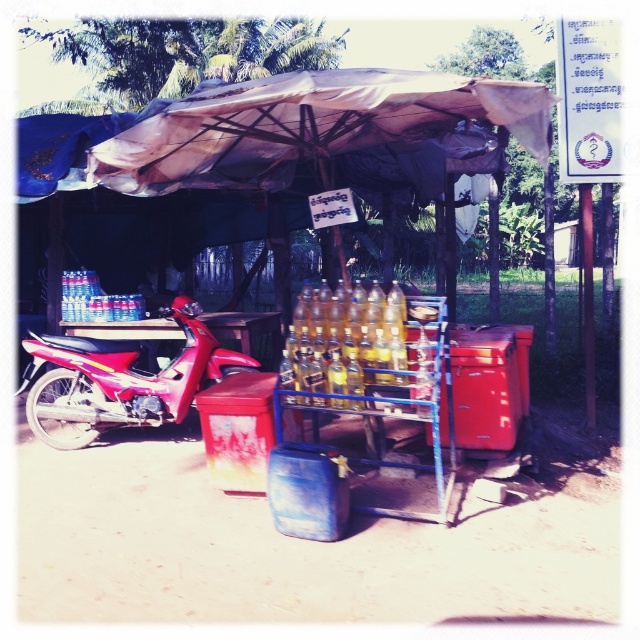
Can you confirm if metallic blue cart at center is taller than metallic red motorcycle at left?

Yes.

Does metallic blue cart at center appear over metallic red motorcycle at left?

No.

Is point (451, 440) closer to viewer compared to point (163, 401)?

Yes, it is.

The height and width of the screenshot is (640, 640). I want to click on metallic blue cart at center, so click(x=368, y=396).

Where is `metallic red motorcycle at left`? This screenshot has width=640, height=640. metallic red motorcycle at left is located at coordinates (120, 380).

Is metallic red motorcycle at left further to camera compared to yellow glass bottles at center?

That is True.

Which is behind, point (144, 417) or point (333, 324)?

The point (144, 417) is more distant.

Locate an element on the screen. metallic red motorcycle at left is located at coordinates click(120, 380).

Who is lower down, metallic blue cart at center or yellow glass bottles at center?

Positioned lower is metallic blue cart at center.

Does metallic blue cart at center have a greater height compared to yellow glass bottles at center?

Yes.

Does point (371, 451) come behind point (312, 340)?

Yes, point (371, 451) is farther from viewer.

At what (x,y) coordinates should I click in order to perform the action: click on metallic blue cart at center. Please return your answer as a coordinate pair (x, y). This screenshot has width=640, height=640. Looking at the image, I should click on (368, 396).